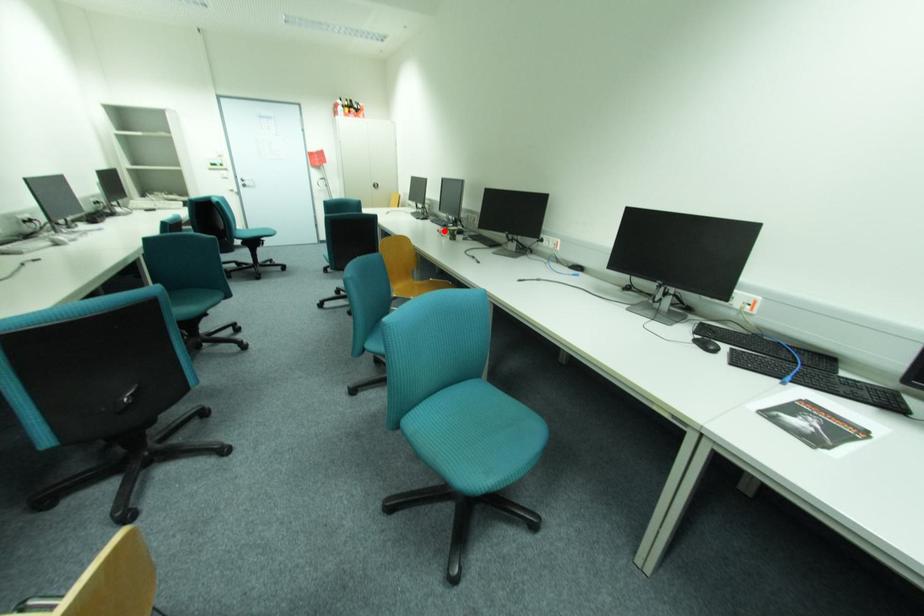
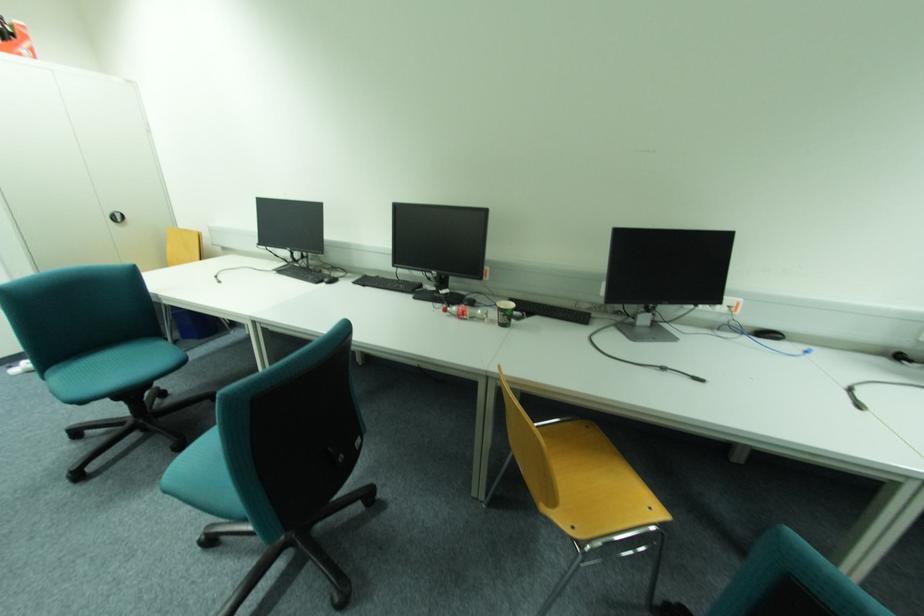
Locate, in the second image, the point that corresponds to the highlighted location in the first image.

(451, 310)